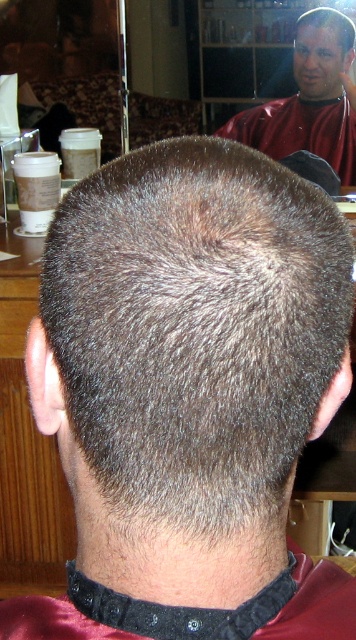
Does dark brown hair at center have a greater width compared to dark gray hair at center?

Yes.

Can you confirm if dark brown hair at center is bigger than dark gray hair at center?

Correct, dark brown hair at center is larger in size than dark gray hair at center.

Which is in front, point (182, 346) or point (323, 17)?

Point (182, 346) is more forward.

This screenshot has width=356, height=640. Find the location of `dark brown hair at center`. dark brown hair at center is located at coordinates (196, 324).

Based on the photo, can you confirm if dark brown hair at center is positioned to the right of smooth red barber at upper right?

No, dark brown hair at center is not to the right of smooth red barber at upper right.

This screenshot has height=640, width=356. Identify the location of dark brown hair at center. (196, 324).

Where is `dark brown hair at center`? Image resolution: width=356 pixels, height=640 pixels. dark brown hair at center is located at coordinates (196, 324).

Is smooth red barber at upper right to the left of dark gray hair at center from the viewer's perspective?

Correct, you'll find smooth red barber at upper right to the left of dark gray hair at center.

Is smooth red barber at upper right further to camera compared to dark gray hair at center?

Yes, it is.

Who is more distant from viewer, (322, 44) or (327, 90)?

Positioned behind is point (327, 90).

You are a GUI agent. You are given a task and a screenshot of the screen. Output one action in this format:
    pyautogui.click(x=<x>, y=<y>)
    Task: Click on the smooth red barber at upper right
    
    Given the screenshot: What is the action you would take?
    pyautogui.click(x=310, y=99)